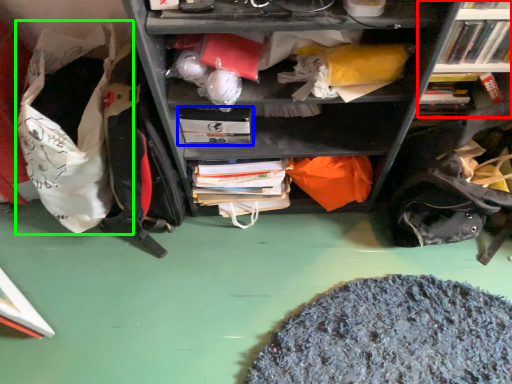
Question: Which object is the farthest from bookcase (highlighted by a red box)? Choose among these: paperback book (highlighted by a blue box) or bean bag chair (highlighted by a green box).

Choices:
 (A) paperback book
 (B) bean bag chair

Answer: (B)